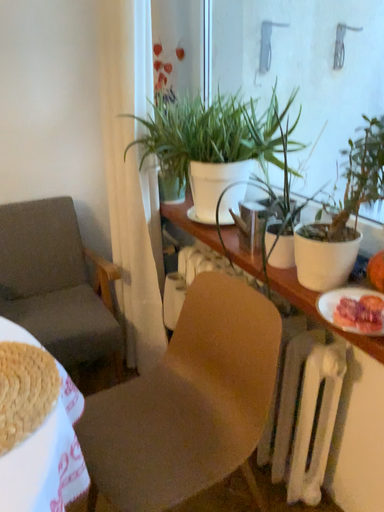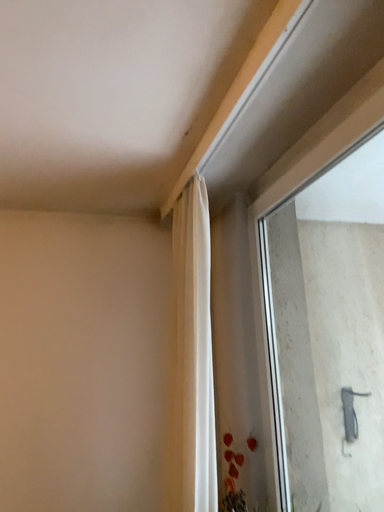
Question: How did the camera likely rotate when shooting the video?

Choices:
 (A) rotated left
 (B) rotated right

Answer: (A)